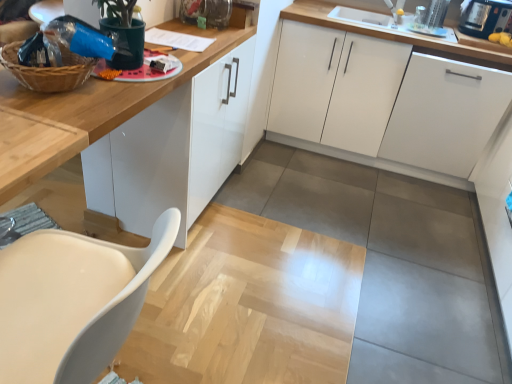
Question: From the image's perspective, is white matte cabinet at right, the third cabinetry viewed from the left, on top of white matte cabinet at center, the 2th cabinetry when ordered from right to left?

Choices:
 (A) no
 (B) yes

Answer: (A)

Question: Can you confirm if white matte cabinet at right, the first cabinetry from the right, is taller than white matte cabinet at center, which is the second cabinetry in left-to-right order?

Choices:
 (A) yes
 (B) no

Answer: (B)

Question: Can you confirm if white matte cabinet at right, the first cabinetry from the right, is positioned to the left of white matte cabinet at center, the 2th cabinetry when ordered from right to left?

Choices:
 (A) yes
 (B) no

Answer: (B)

Question: Is white matte cabinet at right, the first cabinetry from the right, facing towards white matte cabinet at center, which is the second cabinetry in left-to-right order?

Choices:
 (A) yes
 (B) no

Answer: (A)

Question: Is white matte cabinet at right, the first cabinetry from the right, closer to the viewer compared to white matte cabinet at center, which is the second cabinetry in left-to-right order?

Choices:
 (A) yes
 (B) no

Answer: (A)

Question: In terms of height, does white matte chair at lower left look taller or shorter compared to white matte cabinet at center, the 2th cabinetry when ordered from right to left?

Choices:
 (A) short
 (B) tall

Answer: (A)

Question: Is white matte chair at lower left inside or outside of white matte cabinet at center, which is the second cabinetry in left-to-right order?

Choices:
 (A) outside
 (B) inside

Answer: (A)

Question: From a real-world perspective, is white matte chair at lower left above or below white matte cabinet at center, the 2th cabinetry when ordered from right to left?

Choices:
 (A) above
 (B) below

Answer: (A)

Question: From the image's perspective, is white matte chair at lower left located above or below white matte cabinet at center, the 2th cabinetry when ordered from right to left?

Choices:
 (A) below
 (B) above

Answer: (A)

Question: Considering the positions of point (39, 251) and point (187, 147), is point (39, 251) closer or farther from the camera than point (187, 147)?

Choices:
 (A) closer
 (B) farther

Answer: (A)

Question: Relative to white glossy cabinet at upper center, the 3th cabinetry when ordered from right to left, is white matte chair at lower left in front or behind?

Choices:
 (A) front
 (B) behind

Answer: (A)

Question: Would you say white matte chair at lower left is to the left or to the right of white glossy cabinet at upper center, the 3th cabinetry when ordered from right to left, in the picture?

Choices:
 (A) left
 (B) right

Answer: (A)

Question: From the image's perspective, is white matte chair at lower left located above or below white glossy cabinet at upper center, the first cabinetry when ordered from left to right?

Choices:
 (A) above
 (B) below

Answer: (B)

Question: In terms of size, does white matte cabinet at right, the first cabinetry from the right, appear bigger or smaller than black plastic toaster at upper right?

Choices:
 (A) small
 (B) big

Answer: (B)

Question: Is white matte cabinet at right, the third cabinetry viewed from the left, inside the boundaries of black plastic toaster at upper right, or outside?

Choices:
 (A) outside
 (B) inside

Answer: (A)